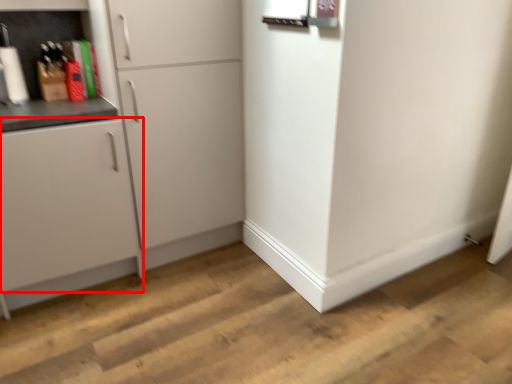
Question: From the image's perspective, what is the correct spatial positioning of cabinetry (annotated by the red box) in reference to cabinetry?

Choices:
 (A) above
 (B) below

Answer: (B)